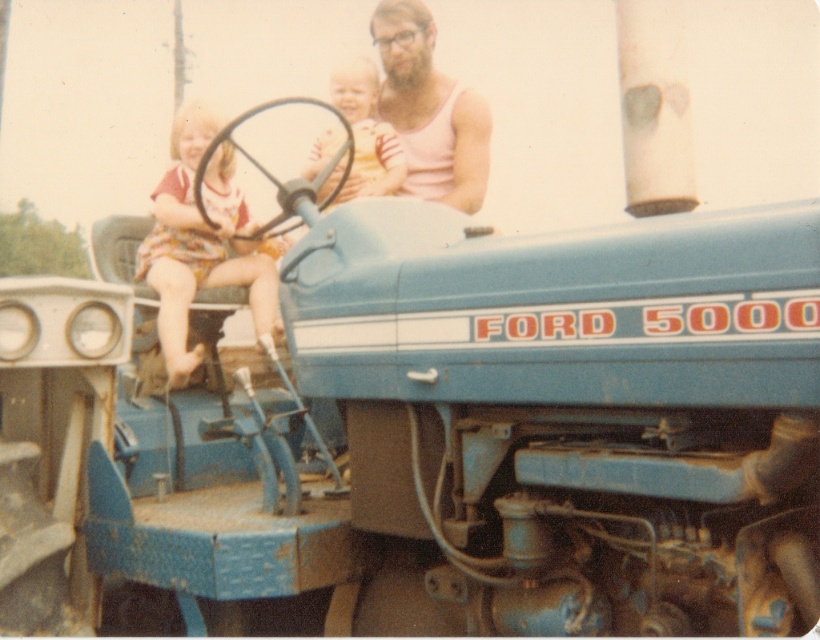
Question: Which of these objects is positioned farthest from the pink tank top at upper center?

Choices:
 (A) striped fabric shirt at center
 (B) floral dress at left

Answer: (B)

Question: Is pink tank top at upper center bigger than striped fabric shirt at center?

Choices:
 (A) yes
 (B) no

Answer: (A)

Question: From the image, what is the correct spatial relationship of pink tank top at upper center in relation to striped fabric shirt at center?

Choices:
 (A) left
 (B) right

Answer: (B)

Question: Which object is positioned farthest from the striped fabric shirt at center?

Choices:
 (A) pink tank top at upper center
 (B) floral dress at left

Answer: (B)

Question: Does floral dress at left have a smaller size compared to pink tank top at upper center?

Choices:
 (A) yes
 (B) no

Answer: (B)

Question: Estimate the real-world distances between objects in this image. Which object is closer to the pink tank top at upper center?

Choices:
 (A) striped fabric shirt at center
 (B) floral dress at left

Answer: (A)